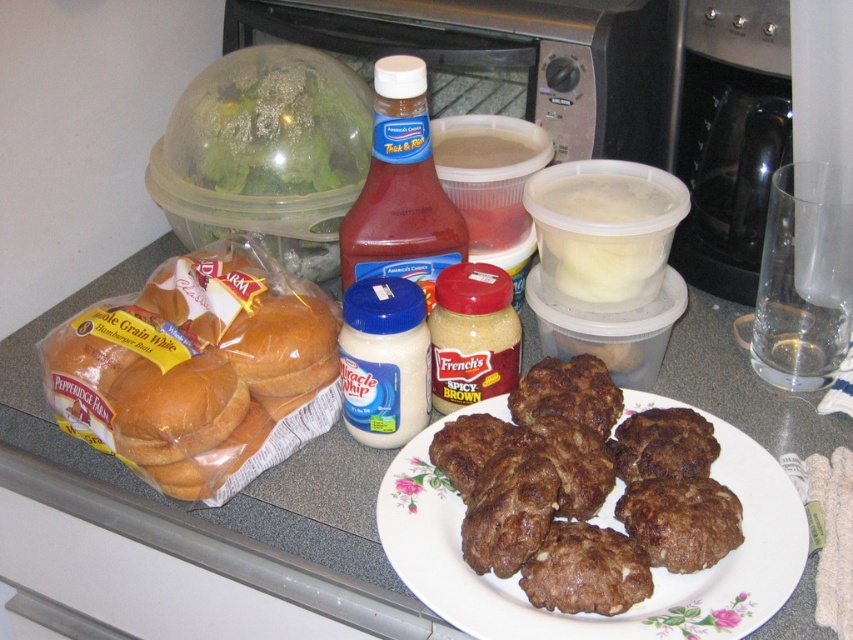
Question: Is the position of brown matte/hard bread at left more distant than that of brown crispy patty at center?

Choices:
 (A) no
 (B) yes

Answer: (B)

Question: Which point is farther to the camera?

Choices:
 (A) (583, 580)
 (B) (190, 260)

Answer: (B)

Question: Which object is closer to the camera taking this photo?

Choices:
 (A) brown matte/hard bread at left
 (B) brown crispy patty at center

Answer: (B)

Question: Can you confirm if brown crispy patty at center is positioned to the left of red glass bottle at center?

Choices:
 (A) yes
 (B) no

Answer: (B)

Question: Which of the following is the farthest from the observer?

Choices:
 (A) (698, 481)
 (B) (112, 435)
 (C) (407, 86)

Answer: (C)

Question: Is brown matte/hard bread at left thinner than red glass bottle at center?

Choices:
 (A) yes
 (B) no

Answer: (B)